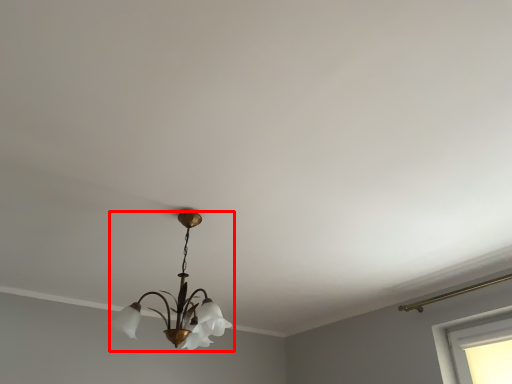
Question: Observing the image, what is the correct spatial positioning of lamp (annotated by the red box) in reference to window?

Choices:
 (A) right
 (B) left

Answer: (B)